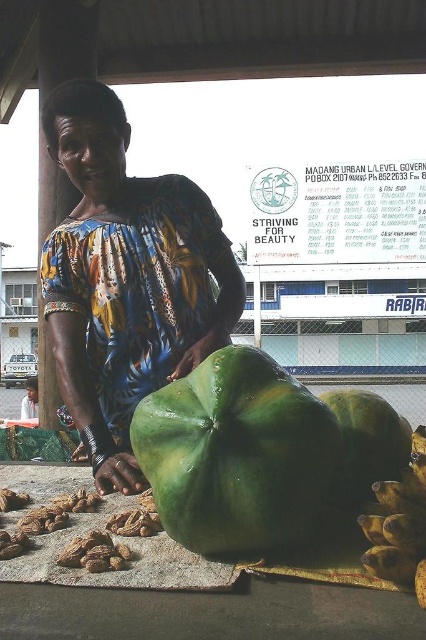
Question: Does printed fabric woman at center appear over green matte fruit at center?

Choices:
 (A) no
 (B) yes

Answer: (B)

Question: Is printed fabric woman at center smaller than matte black shirt at center?

Choices:
 (A) no
 (B) yes

Answer: (A)

Question: Does printed fabric woman at center appear under yellow-green textured bananas at lower right?

Choices:
 (A) no
 (B) yes

Answer: (A)

Question: Which of these objects is positioned farthest from the green matte fruit at center?

Choices:
 (A) yellow-green textured bananas at lower right
 (B) printed fabric woman at center

Answer: (B)

Question: Which is farther from the green matte fruit at center?

Choices:
 (A) printed fabric woman at center
 (B) matte black shirt at center
 (C) yellow-green textured bananas at lower right
 (D) green matte papaya at center

Answer: (B)

Question: Which of the following is the farthest from the observer?

Choices:
 (A) (28, 394)
 (B) (422, 449)
 (C) (348, 413)

Answer: (A)